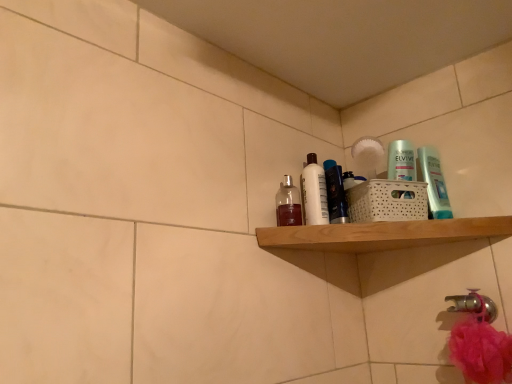
Question: Is shiny black bottle at center, which is the 2th toiletry in right-to-left order, spatially inside wooden shelf at upper right, or outside of it?

Choices:
 (A) outside
 (B) inside

Answer: (A)

Question: Is shiny black bottle at center, which is the 2th toiletry in right-to-left order, taller or shorter than wooden shelf at upper right?

Choices:
 (A) short
 (B) tall

Answer: (B)

Question: Which object is the farthest from the translucent glass bottle at upper center, placed as the first toiletry when sorted from left to right?

Choices:
 (A) gold metallic faucet at lower right
 (B) translucent plastic bottle at upper right, the 1th toiletry when ordered from right to left
 (C) shiny black bottle at center, which is the third toiletry in left-to-right order
 (D) white glossy bottle at upper center, which is the 3th toiletry in right-to-left order
 (E) wooden shelf at upper right

Answer: (A)

Question: Which of these objects is positioned closest to the shiny black bottle at center, which is the 2th toiletry in right-to-left order?

Choices:
 (A) translucent plastic bottle at upper right, which is counted as the 4th toiletry, starting from the left
 (B) white glossy bottle at upper center, the second toiletry from the left
 (C) translucent glass bottle at upper center, placed as the first toiletry when sorted from left to right
 (D) wooden shelf at upper right
 (E) gold metallic faucet at lower right

Answer: (B)